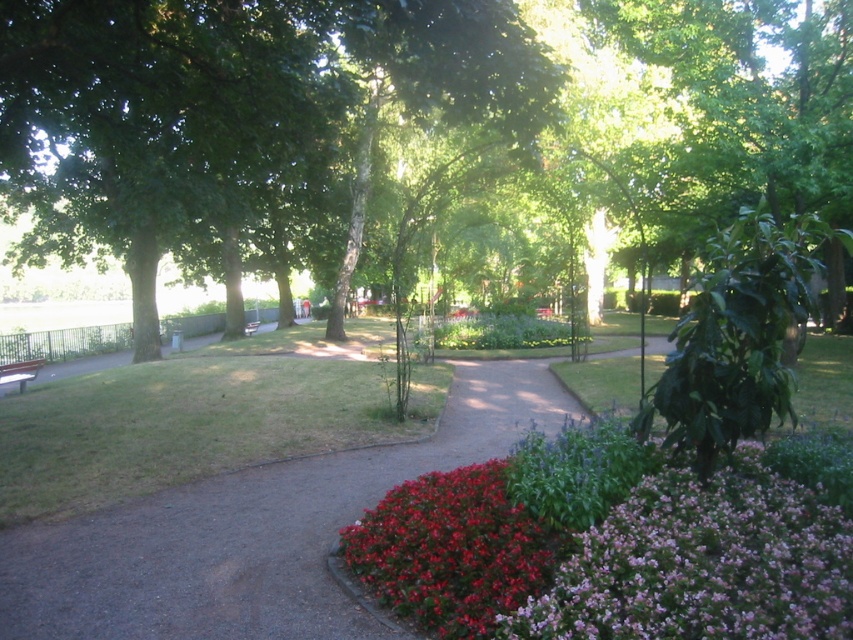
Question: Which object is closer to the camera taking this photo?

Choices:
 (A) wooden park bench at center
 (B) vivid red petals at center
 (C) purple textured flowers at lower right
 (D) dirt path at center

Answer: (C)

Question: Is green leafy tree at center thinner than purple textured flowers at lower right?

Choices:
 (A) yes
 (B) no

Answer: (B)

Question: Which object is closer to the camera taking this photo?

Choices:
 (A) dirt path at center
 (B) green leafy tree at center
 (C) vivid red petals at center

Answer: (C)

Question: Considering the real-world distances, which object is closest to the vivid red petals at center?

Choices:
 (A) purple textured flowers at lower right
 (B) dirt path at center
 (C) green leafy tree at center

Answer: (A)

Question: Does green leafy tree at center appear on the left side of purple textured flowers at lower right?

Choices:
 (A) no
 (B) yes

Answer: (B)

Question: Can you confirm if vivid red petals at center is positioned to the right of wooden park bench at center?

Choices:
 (A) yes
 (B) no

Answer: (A)